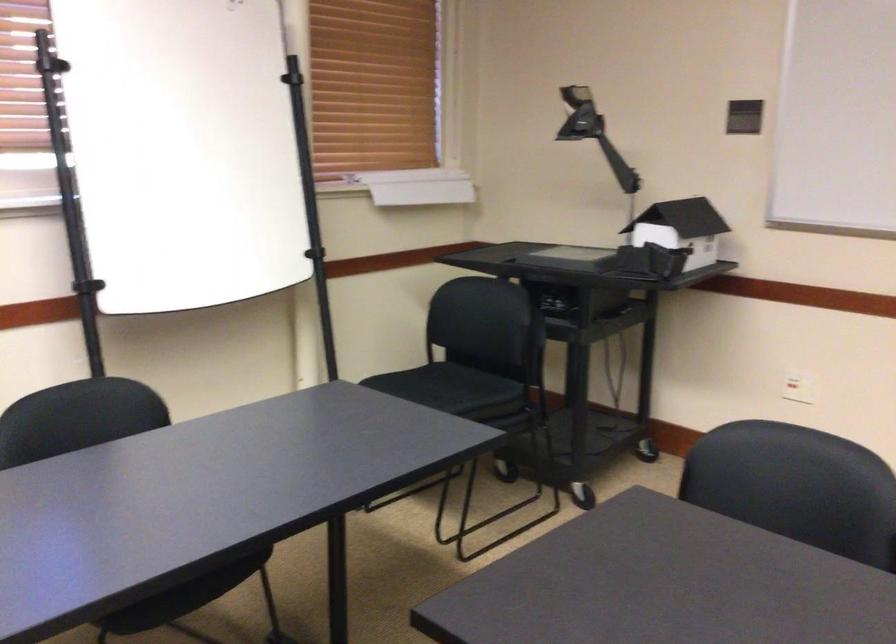
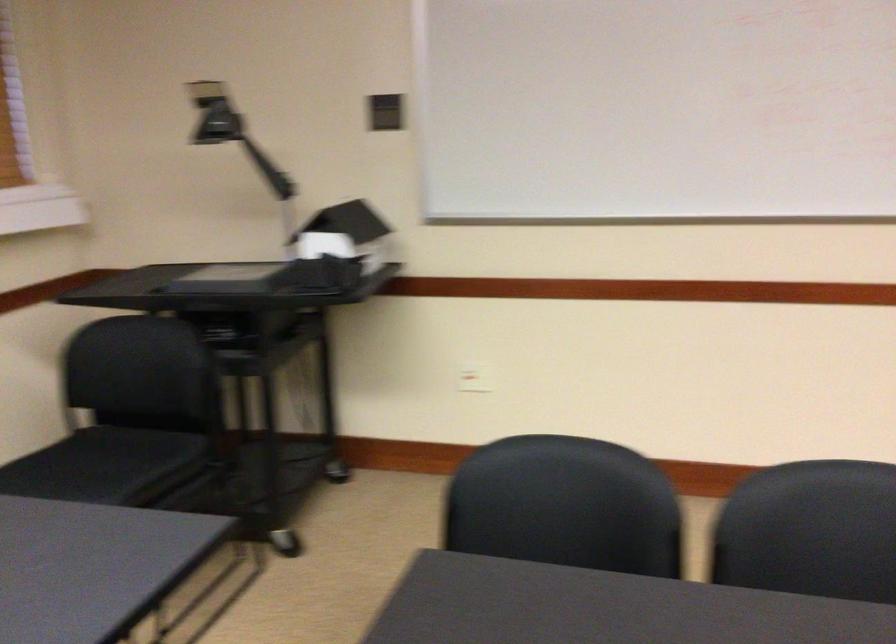
Question: The images are taken continuously from a first-person perspective. In which direction is your viewpoint rotating?

Choices:
 (A) Left
 (B) Right
 (C) Up
 (D) Down

Answer: (B)